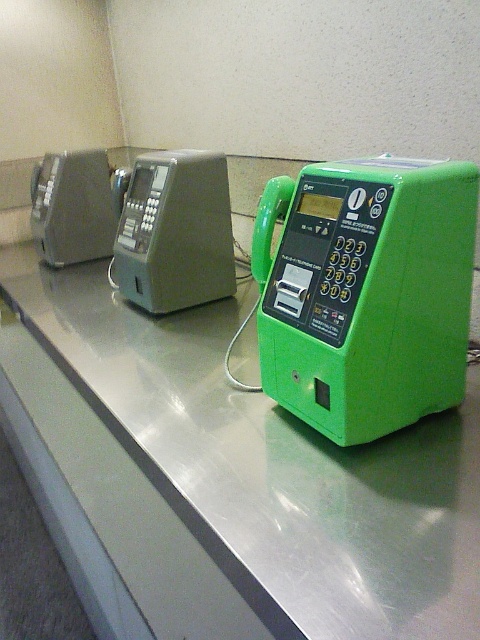
Question: Does green plastic payphone at center appear over matte gray phone box at center?

Choices:
 (A) yes
 (B) no

Answer: (B)

Question: Considering the real-world distances, which object is closest to the matte gray phone box at center?

Choices:
 (A) green plastic phone at right
 (B) green plastic payphone at center

Answer: (A)

Question: Which point is closer to the camera?

Choices:
 (A) (163, 477)
 (B) (230, 276)
 (C) (437, 224)

Answer: (C)

Question: Which of these objects is positioned closest to the green plastic phone at right?

Choices:
 (A) green plastic payphone at center
 (B) matte gray phone box at center

Answer: (B)

Question: Is green plastic phone at right to the right of green plastic payphone at center from the viewer's perspective?

Choices:
 (A) yes
 (B) no

Answer: (B)

Question: Can you confirm if green plastic phone at right is thinner than matte gray phone box at center?

Choices:
 (A) yes
 (B) no

Answer: (B)